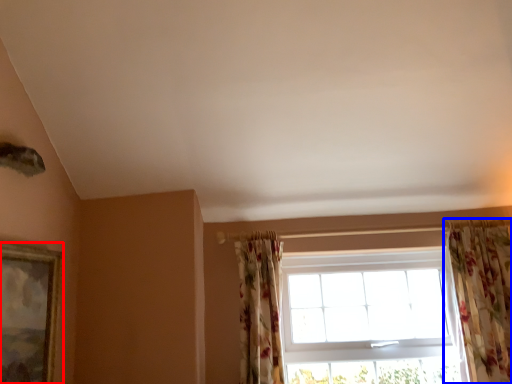
Question: Which object appears farthest to the camera in this image, picture frame (highlighted by a red box) or curtain (highlighted by a blue box)?

Choices:
 (A) picture frame
 (B) curtain

Answer: (B)